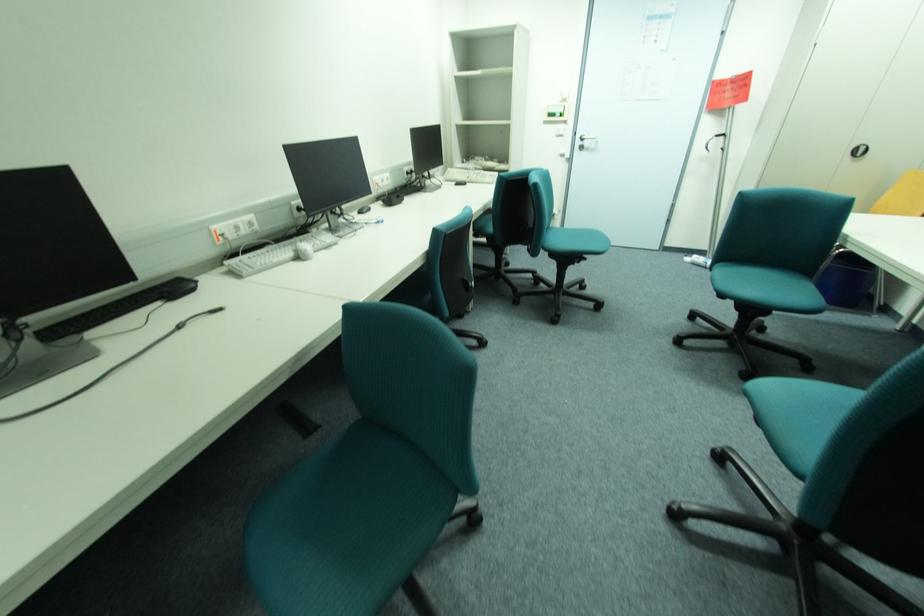
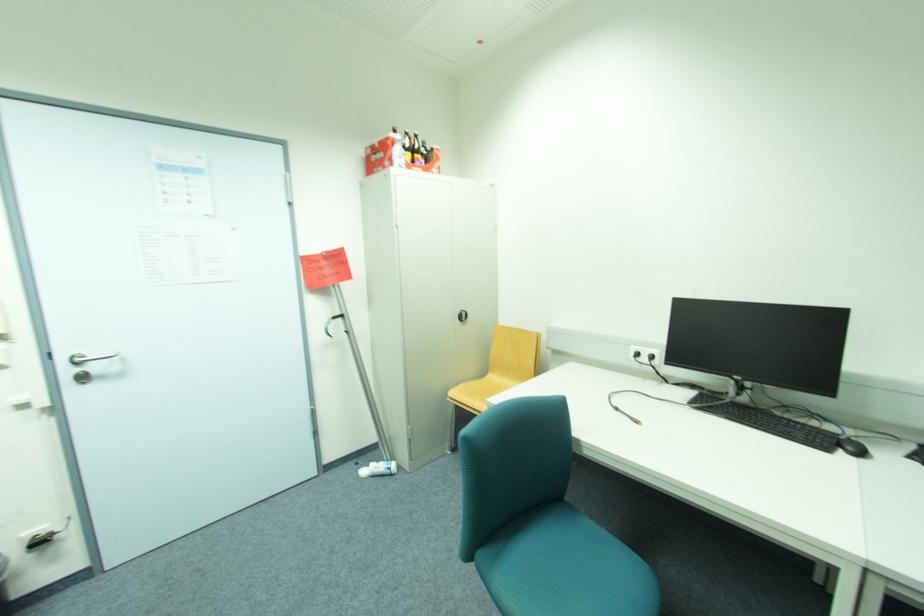
Question: I am providing you with two images of the same scene from different viewpoints. Please identify which objects are invisible in image2.

Choices:
 (A) silver door handle
 (B) yellow chair sitting surface
 (C) teal chair sitting surface
 (D) none of these

Answer: (D)